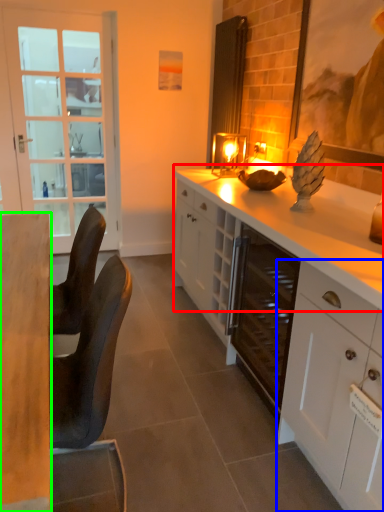
Question: Which is farther away from countertop (highlighted by a red box)? cabinetry (highlighted by a blue box) or desk (highlighted by a green box)?

Choices:
 (A) cabinetry
 (B) desk

Answer: (B)